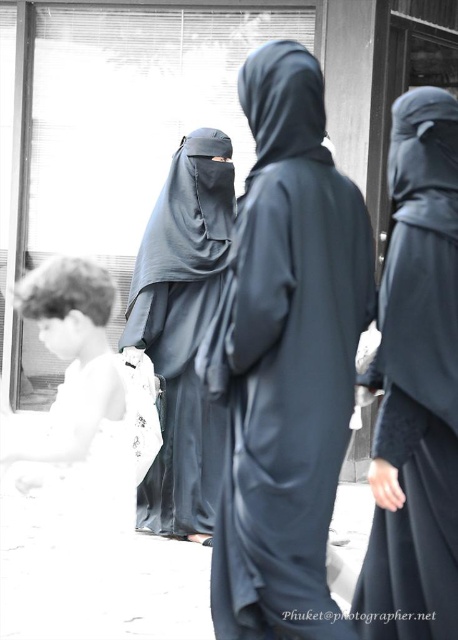
You are a photographer trying to capture a clear shot of the transparent glass shop window at center and the dark gray matte niqab at center. Based on their heights, which object should you focus on first to ensure it is fully in frame?

The transparent glass shop window at center has a lesser height compared to dark gray matte niqab at center, so you should focus on the dark gray matte niqab at center first to ensure it is fully in frame.

You are a delivery person trying to see the menu of a shop through the transparent glass shop window at center while standing behind the matte black robe at right. Can you see the menu clearly?

The transparent glass shop window at center is taller than the matte black robe at right, so you can see the menu clearly through the transparent glass shop window at center as it extends above the matte black robe at right.